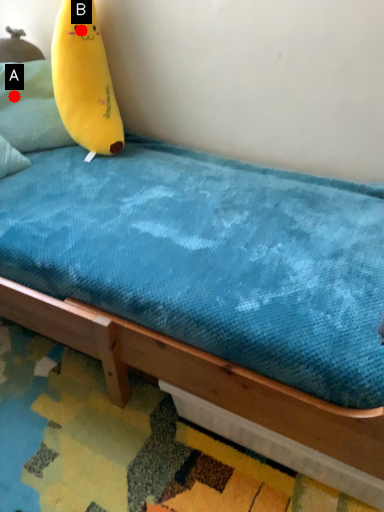
Question: Two points are circled on the image, labeled by A and B beside each circle. Among these points, which one is farthest from the camera?

Choices:
 (A) A is further
 (B) B is further

Answer: (A)